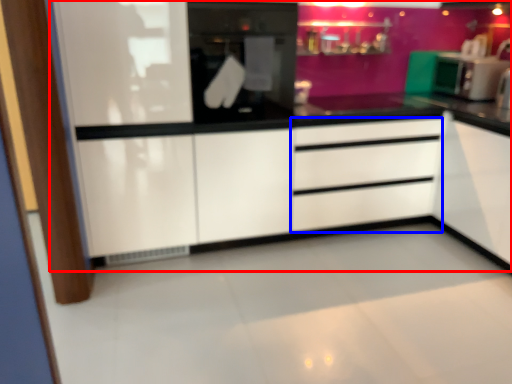
Question: Which of the following is the closest to the observer, dresser (highlighted by a red box) or drawer (highlighted by a blue box)?

Choices:
 (A) dresser
 (B) drawer

Answer: (A)